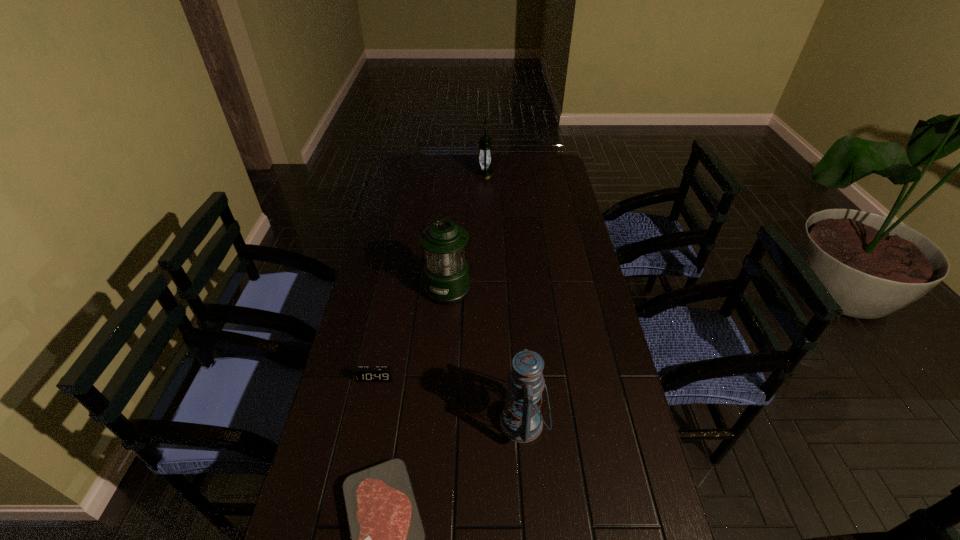
Identify the location of the farthest object. (484, 171).

Find the location of `the leftmost lantern`. the leftmost lantern is located at coordinates (446, 273).

Find the location of a particular element. The height and width of the screenshot is (540, 960). the second farthest lantern is located at coordinates (446, 273).

Locate an element on the screen. the second nearest object is located at coordinates (521, 421).

Locate an element on the screen. alarm clock is located at coordinates (362, 373).

At what (x,y) coordinates should I click in order to perform the action: click on the second shortest object. Please return your answer as a coordinate pair (x, y). The width and height of the screenshot is (960, 540). Looking at the image, I should click on (362, 373).

Locate an element on the screen. The width and height of the screenshot is (960, 540). vacant space located on the side where the farthest object emits light is located at coordinates (401, 174).

Find the location of a particular element. Image resolution: width=960 pixels, height=540 pixels. free space located 0.060m on the side where the farthest object emits light is located at coordinates (462, 174).

Where is `free space located on the side where the farthest object emits light`? free space located on the side where the farthest object emits light is located at coordinates (422, 174).

Where is `vacant region located on the right of the fourth nearest object`? vacant region located on the right of the fourth nearest object is located at coordinates (502, 288).